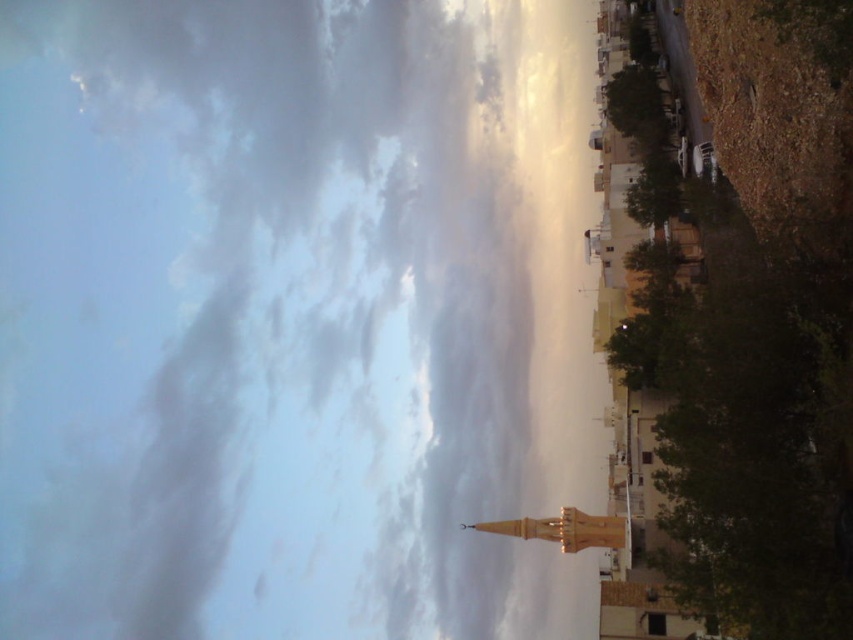
You are standing in the urban landscape depicted in the scene. You see a point marked at coordinates (310, 330). Based on the scene description, what does this point most likely represent?

The point at coordinates (310, 330) marks the cloudy sky at upper center.

You are standing in the middle of the urban landscape looking towards the buildings. There are two points marked in the image. Which point is closer to you, point [265,84] or point [563,536]?

Point [265,84] is closer to you because it is further to the viewer than point [563,536].